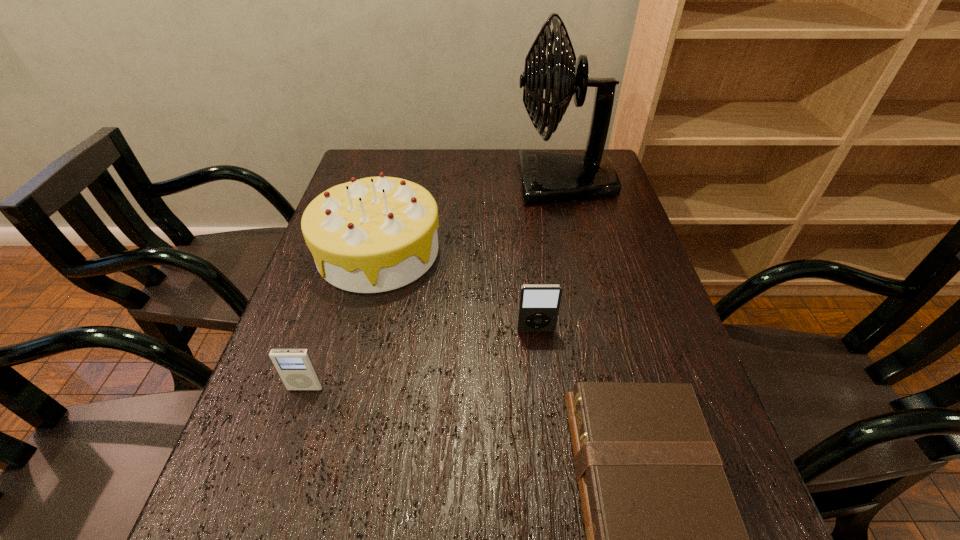
The width and height of the screenshot is (960, 540). I want to click on vacant space at the left edge of the desktop, so click(x=285, y=411).

Where is `free space at the right edge`? free space at the right edge is located at coordinates (614, 247).

Where is `free spot between the tallest object and the second nearest object`? The height and width of the screenshot is (540, 960). free spot between the tallest object and the second nearest object is located at coordinates (435, 285).

Where is `free point between the third farthest object and the second farthest object`? free point between the third farthest object and the second farthest object is located at coordinates (457, 291).

Image resolution: width=960 pixels, height=540 pixels. In order to click on free space between the fourth shortest object and the fan in this screenshot , I will do `click(470, 217)`.

The image size is (960, 540). Identify the location of vacant space in between the shorter iPod and the farther iPod. (420, 359).

The image size is (960, 540). What are the coordinates of `vacant space that is in between the tallest object and the left iPod` in the screenshot? It's located at (435, 285).

Locate an element on the screen. The height and width of the screenshot is (540, 960). empty space between the second nearest object and the fourth shortest object is located at coordinates (342, 320).

Identify which object is located as the nearest to the farthest object. Please provide its 2D coordinates. Your answer should be formatted as a tuple, i.e. [(x, y)], where the tuple contains the x and y coordinates of a point satisfying the conditions above.

[(375, 234)]

Where is `object that is the second closest to the nearest object`? This screenshot has width=960, height=540. object that is the second closest to the nearest object is located at coordinates (375, 234).